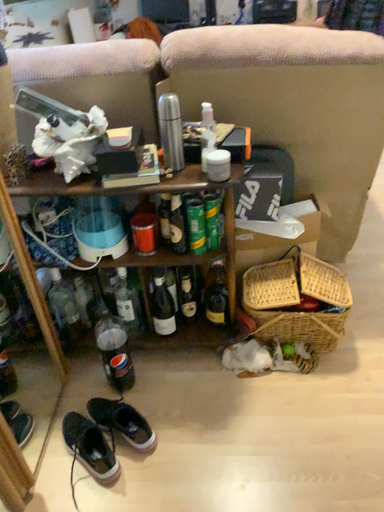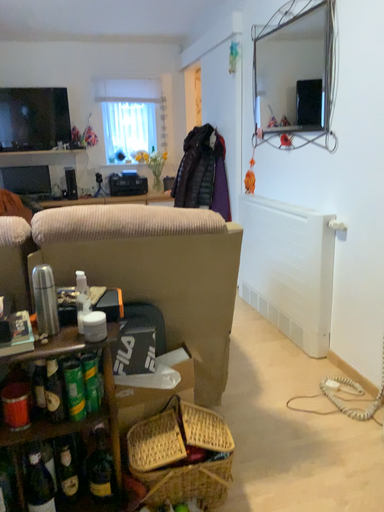
Question: How did the camera likely rotate when shooting the video?

Choices:
 (A) rotated downward
 (B) rotated upward

Answer: (B)